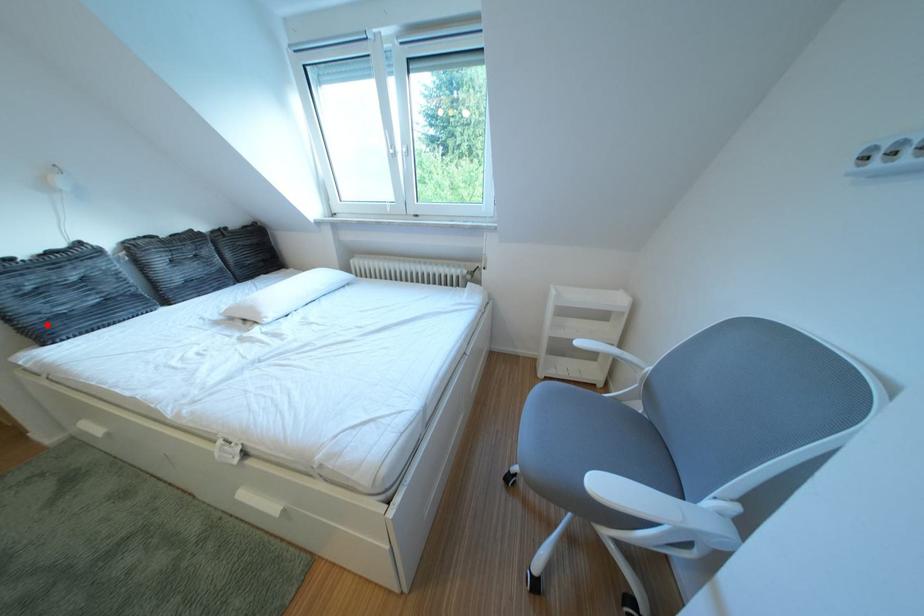
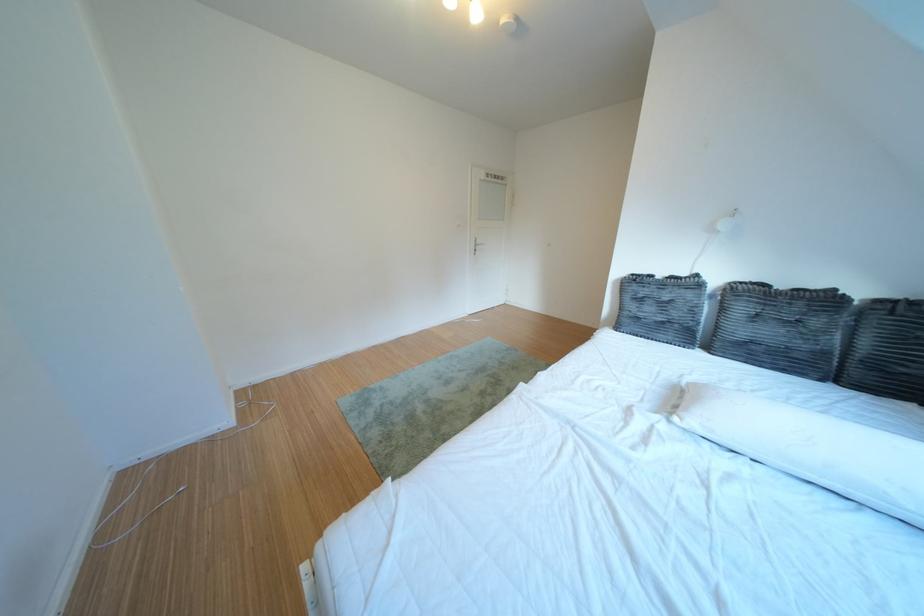
In the second image, find the point that corresponds to the highlighted location in the first image.

(639, 318)